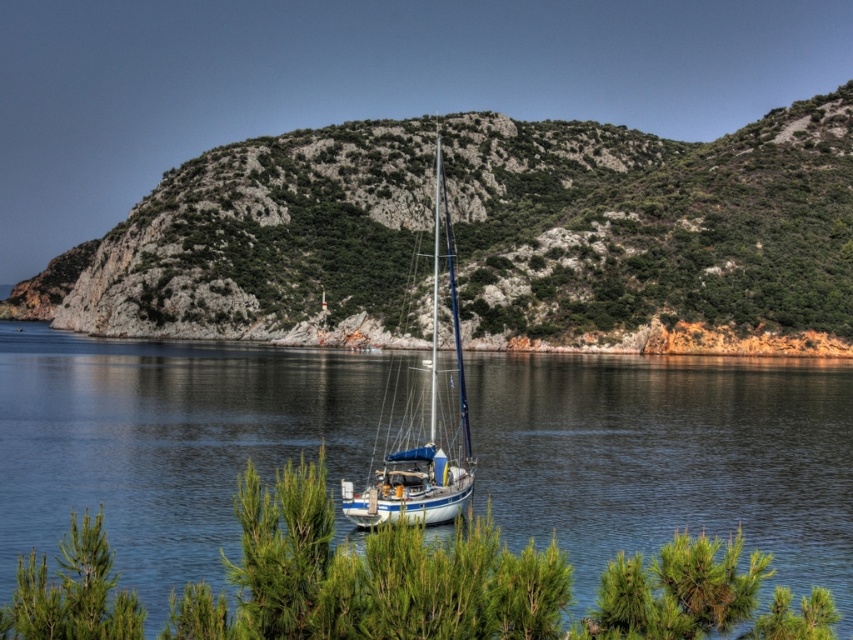
Is point (425, 154) less distant than point (416, 388)?

No, (425, 154) is behind (416, 388).

Between green rocky hillside at center and white glossy sailboat at center, which one appears on the left side from the viewer's perspective?

From the viewer's perspective, green rocky hillside at center appears more on the left side.

Which is in front, point (250, 168) or point (448, 376)?

Point (448, 376) is more forward.

Where is `green rocky hillside at center`? Image resolution: width=853 pixels, height=640 pixels. green rocky hillside at center is located at coordinates (657, 228).

Between blue water at center and white glossy sailboat at center, which one is positioned higher?

white glossy sailboat at center

Can you confirm if blue water at center is smaller than white glossy sailboat at center?

No, blue water at center is not smaller than white glossy sailboat at center.

The height and width of the screenshot is (640, 853). Identify the location of blue water at center. (669, 458).

The height and width of the screenshot is (640, 853). I want to click on blue water at center, so click(669, 458).

Looking at this image, which is above, green rocky hillside at center or blue water at center?

green rocky hillside at center is higher up.

Locate an element on the screen. green rocky hillside at center is located at coordinates (657, 228).